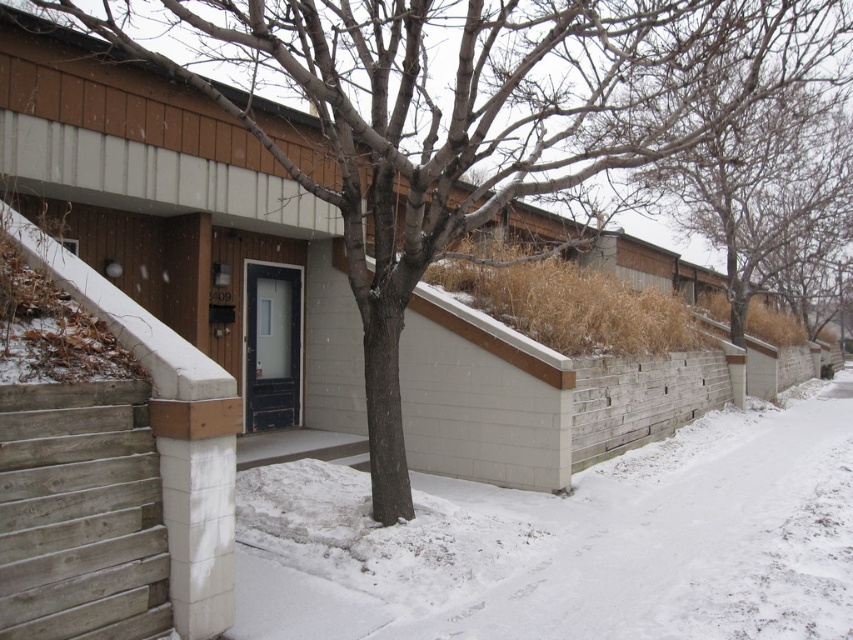
Question: Does white powdery snow at lower center appear under bare branches at upper center?

Choices:
 (A) yes
 (B) no

Answer: (A)

Question: Which is farther from the bare branches at upper center?

Choices:
 (A) gray wood stairs at lower left
 (B) white powdery snow at lower center

Answer: (A)

Question: Which object is closer to the camera taking this photo?

Choices:
 (A) bare branches at upper center
 (B) gray wood stairs at lower left

Answer: (B)

Question: Can you confirm if white powdery snow at lower center is wider than bare branches at upper center?

Choices:
 (A) yes
 (B) no

Answer: (B)

Question: Which point is closer to the camera?

Choices:
 (A) white powdery snow at lower center
 (B) gray wood stairs at lower left
 (C) bare branches at upper center

Answer: (B)

Question: Is white powdery snow at lower center bigger than gray wood stairs at lower left?

Choices:
 (A) yes
 (B) no

Answer: (A)